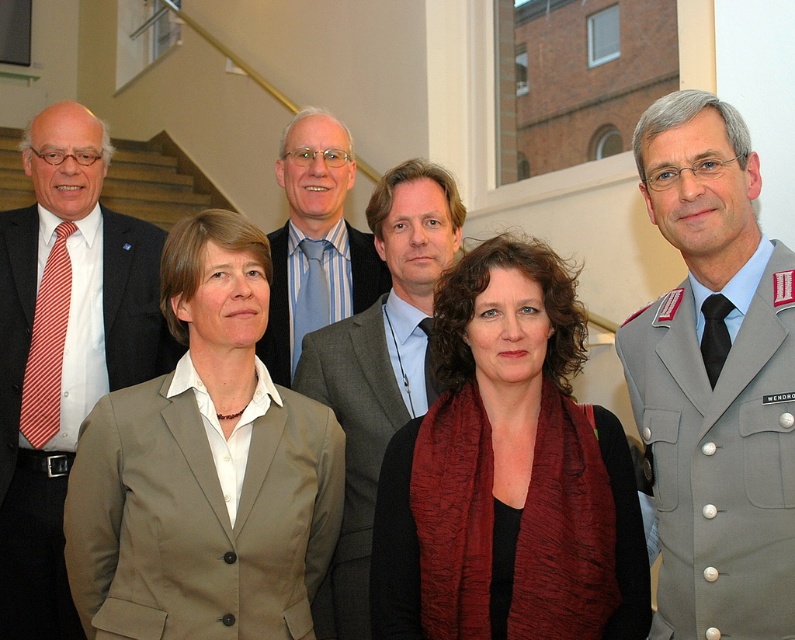
Question: Does gray uniform at center appear on the left side of red striped tie at left?

Choices:
 (A) yes
 (B) no

Answer: (B)

Question: Does red striped tie at left have a greater width compared to gray wool suit at center?

Choices:
 (A) yes
 (B) no

Answer: (A)

Question: Among these points, which one is farthest from the camera?

Choices:
 (A) (402, 353)
 (B) (95, 131)

Answer: (B)

Question: Estimate the real-world distances between objects in this image. Which object is closer to the light blue striped tie at center?

Choices:
 (A) gray uniform at center
 (B) gray wool suit at center
 (C) beige fabric suit at center
 (D) matte red scarf at center

Answer: (B)

Question: Is beige fabric suit at center to the right of light blue striped tie at center from the viewer's perspective?

Choices:
 (A) no
 (B) yes

Answer: (A)

Question: Which of the following is the closest to the observer?

Choices:
 (A) (363, 380)
 (B) (433, 456)
 (C) (198, 557)
 (D) (669, 129)

Answer: (D)